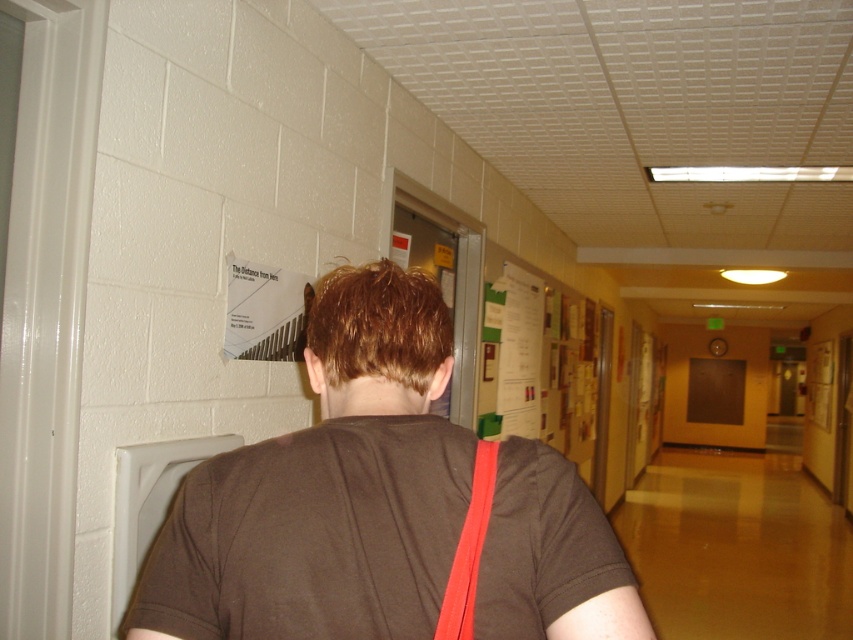
You are a security camera monitoring the hallway. You notice the brown cotton shirt at center and the neon pink fabric strap at back. Which object is taller in the image?

The brown cotton shirt at center is taller than the neon pink fabric strap at back.